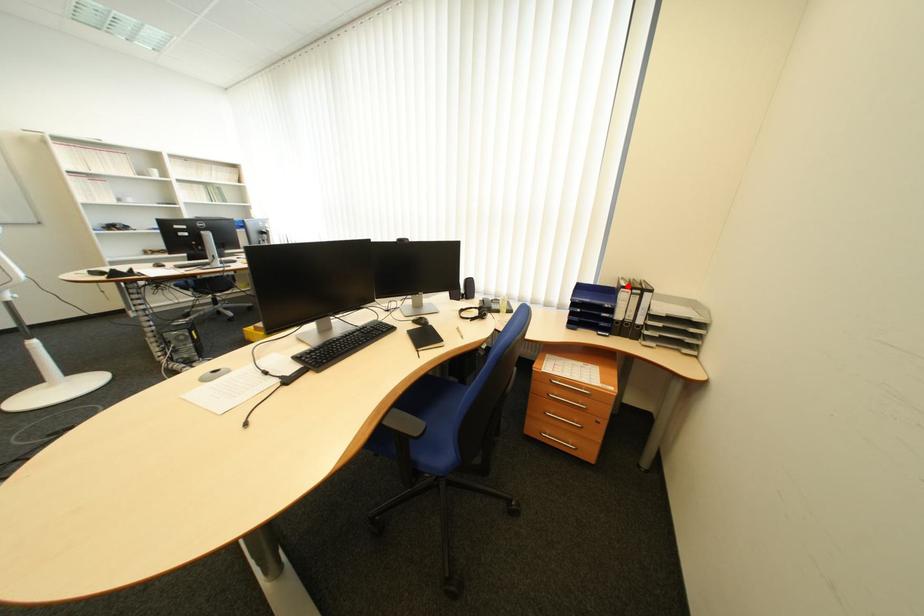
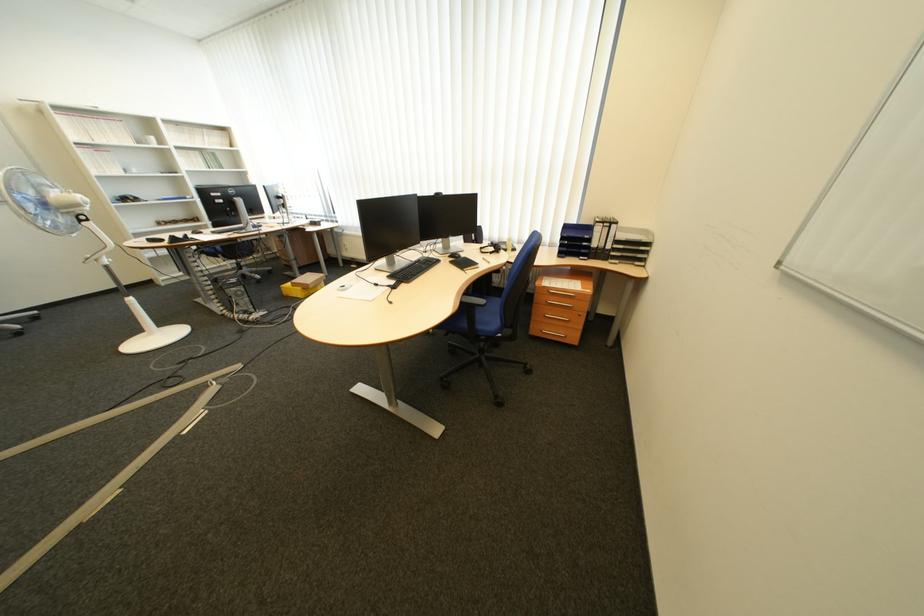
Question: I am providing you with two images of the same scene from different viewpoints. Image1 has a red point marked. In image2, the corresponding 3D location appears at what relative position? Reply with the corresponding letter.

Choices:
 (A) Closer
 (B) Farther

Answer: (A)